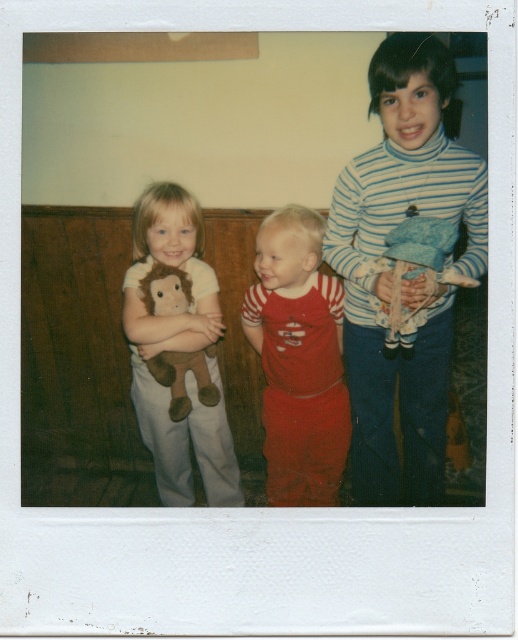
You are a photographer standing in front of the Polaroid photograph. You notice the soft brown plush monkey at left in the image. Can you reach out and touch the monkey if you extend your arm fully?

The soft brown plush monkey at left is 1.88 meters away from viewer, so no, you cannot reach it with your arm fully extended as the distance is greater than an average human arm length.

In the Polaroid photo, there are two items of interest. The blue striped sweater at upper right and the brown plush toy at left. From the perspective of someone looking at the photo, which item is positioned more to the right?

The blue striped sweater at upper right is positioned more to the right than the brown plush toy at left.